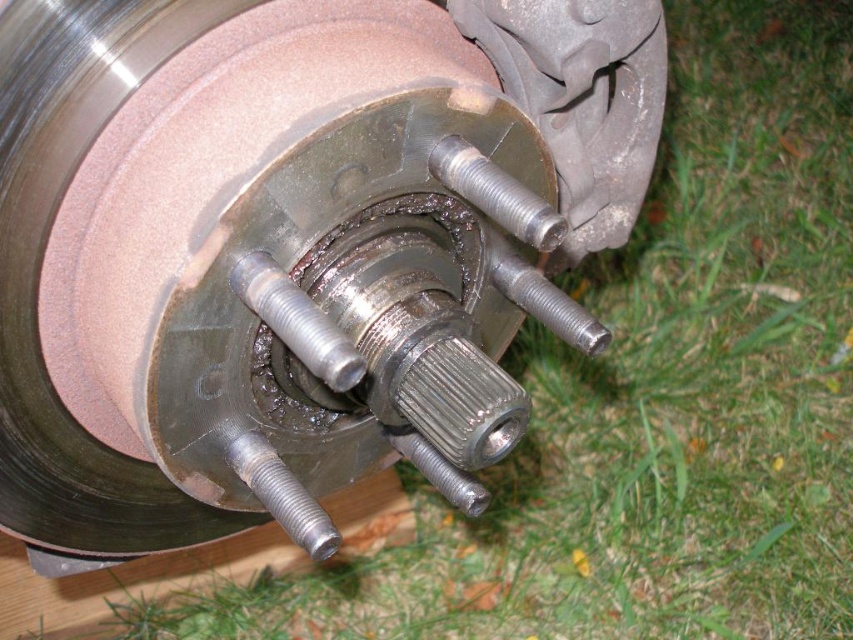
Looking at this image, you are a mechanic trying to access the metallic brake rotor at center for maintenance. You have a tool that requires 28 inches of clearance to operate effectively. Based on the provided information, will you have enough space to use your tool?

The distance between the metallic brake rotor at center and the viewer is 25.80 inches. Since the tool requires 28 inches of clearance, there is insufficient space to use it effectively.

Based on the scene description, which object is wider, the metallic brake rotor at center or the silver metallic bolt at center?

The metallic brake rotor at center is wider than the silver metallic bolt at center according to the description.